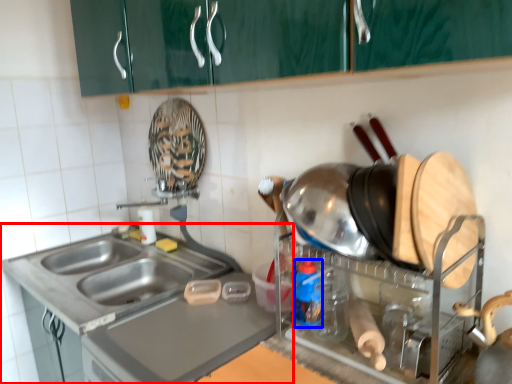
Question: Among these objects, which one is nearest to the camera, countertop (highlighted by a red box) or bottle (highlighted by a blue box)?

Choices:
 (A) countertop
 (B) bottle

Answer: (B)